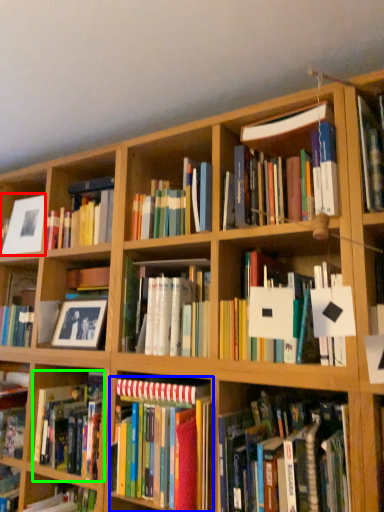
Question: Estimate the real-world distances between objects in this image. Which object is farther from picture frame (highlighted by a red box), book (highlighted by a blue box) or book (highlighted by a green box)?

Choices:
 (A) book
 (B) book

Answer: (A)